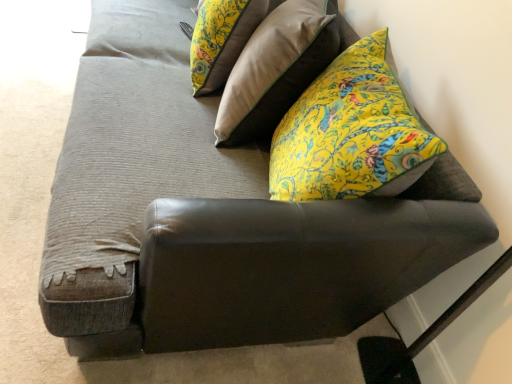
This screenshot has height=384, width=512. What do you see at coordinates (222, 39) in the screenshot?
I see `floral fabric pillow at upper center, arranged as the 1th pillow when viewed from the left` at bounding box center [222, 39].

The image size is (512, 384). In order to click on floral fabric pillow at upper center, arranged as the 1th pillow when viewed from the left in this screenshot , I will do `click(222, 39)`.

Based on the photo, how much space does floral yellow pillow at upper right, arranged as the second pillow when viewed from the left, occupy vertically?

floral yellow pillow at upper right, arranged as the second pillow when viewed from the left, is 26.24 inches tall.

This screenshot has height=384, width=512. What do you see at coordinates (276, 69) in the screenshot?
I see `floral yellow pillow at upper right, arranged as the second pillow when viewed from the left` at bounding box center [276, 69].

How much space does floral yellow pillow at upper right, placed as the first pillow when sorted from right to left, occupy horizontally?

It is 12.90 inches.

The height and width of the screenshot is (384, 512). I want to click on floral yellow pillow at upper right, placed as the first pillow when sorted from right to left, so click(x=276, y=69).

Where is `floral fabric pillow at upper center, which is counted as the 2th pillow, starting from the right`? The width and height of the screenshot is (512, 384). floral fabric pillow at upper center, which is counted as the 2th pillow, starting from the right is located at coordinates (222, 39).

Is floral yellow pillow at upper right, arranged as the second pillow when viewed from the left, to the right of floral fabric pillow at upper center, arranged as the 1th pillow when viewed from the left, from the viewer's perspective?

Indeed, floral yellow pillow at upper right, arranged as the second pillow when viewed from the left, is positioned on the right side of floral fabric pillow at upper center, arranged as the 1th pillow when viewed from the left.

Does floral yellow pillow at upper right, arranged as the second pillow when viewed from the left, lie in front of floral fabric pillow at upper center, arranged as the 1th pillow when viewed from the left?

Yes, the depth of floral yellow pillow at upper right, arranged as the second pillow when viewed from the left, is less than that of floral fabric pillow at upper center, arranged as the 1th pillow when viewed from the left.

Which point is more forward, [302,75] or [257,9]?

Point [302,75]

From the image's perspective, is floral yellow pillow at upper right, arranged as the second pillow when viewed from the left, under floral fabric pillow at upper center, arranged as the 1th pillow when viewed from the left?

Yes.

From a real-world perspective, is floral yellow pillow at upper right, placed as the first pillow when sorted from right to left, physically above floral fabric pillow at upper center, arranged as the 1th pillow when viewed from the left?

Yes.

Which object is thinner, floral yellow pillow at upper right, arranged as the second pillow when viewed from the left, or floral fabric pillow at upper center, which is counted as the 2th pillow, starting from the right?

floral fabric pillow at upper center, which is counted as the 2th pillow, starting from the right.

Considering the sizes of objects floral yellow pillow at upper right, arranged as the second pillow when viewed from the left, and floral fabric pillow at upper center, arranged as the 1th pillow when viewed from the left, in the image provided, who is taller, floral yellow pillow at upper right, arranged as the second pillow when viewed from the left, or floral fabric pillow at upper center, arranged as the 1th pillow when viewed from the left,?

floral yellow pillow at upper right, arranged as the second pillow when viewed from the left.

Can you confirm if floral yellow pillow at upper right, arranged as the second pillow when viewed from the left, is bigger than floral fabric pillow at upper center, which is counted as the 2th pillow, starting from the right?

Yes, floral yellow pillow at upper right, arranged as the second pillow when viewed from the left, is bigger than floral fabric pillow at upper center, which is counted as the 2th pillow, starting from the right.

Choose the correct answer: Is floral yellow pillow at upper right, placed as the first pillow when sorted from right to left, inside floral fabric pillow at upper center, arranged as the 1th pillow when viewed from the left, or outside it?

floral yellow pillow at upper right, placed as the first pillow when sorted from right to left, is outside floral fabric pillow at upper center, arranged as the 1th pillow when viewed from the left.

Based on the photo, are floral yellow pillow at upper right, placed as the first pillow when sorted from right to left, and floral fabric pillow at upper center, which is counted as the 2th pillow, starting from the right, making contact?

floral yellow pillow at upper right, placed as the first pillow when sorted from right to left, and floral fabric pillow at upper center, which is counted as the 2th pillow, starting from the right, are not in contact.

Is floral yellow pillow at upper right, placed as the first pillow when sorted from right to left, positioned with its back to floral fabric pillow at upper center, arranged as the 1th pillow when viewed from the left?

Yes, floral yellow pillow at upper right, placed as the first pillow when sorted from right to left, is positioned with its back facing floral fabric pillow at upper center, arranged as the 1th pillow when viewed from the left.

How far apart are floral yellow pillow at upper right, arranged as the second pillow when viewed from the left, and floral fabric pillow at upper center, which is counted as the 2th pillow, starting from the right?

floral yellow pillow at upper right, arranged as the second pillow when viewed from the left, is 19.14 centimeters from floral fabric pillow at upper center, which is counted as the 2th pillow, starting from the right.

The width and height of the screenshot is (512, 384). Find the location of `pillow below the floral yellow pillow at upper right, placed as the first pillow when sorted from right to left (from a real-world perspective)`. pillow below the floral yellow pillow at upper right, placed as the first pillow when sorted from right to left (from a real-world perspective) is located at coordinates (222, 39).

In the image, is floral fabric pillow at upper center, arranged as the 1th pillow when viewed from the left, on the left side or the right side of floral yellow pillow at upper right, placed as the first pillow when sorted from right to left?

Based on their positions, floral fabric pillow at upper center, arranged as the 1th pillow when viewed from the left, is located to the left of floral yellow pillow at upper right, placed as the first pillow when sorted from right to left.

Is the depth of floral fabric pillow at upper center, arranged as the 1th pillow when viewed from the left, less than that of floral yellow pillow at upper right, placed as the first pillow when sorted from right to left?

No.

Does point (207, 35) come behind point (239, 76)?

Yes.

From the image's perspective, who appears lower, floral fabric pillow at upper center, which is counted as the 2th pillow, starting from the right, or floral yellow pillow at upper right, arranged as the second pillow when viewed from the left?

floral yellow pillow at upper right, arranged as the second pillow when viewed from the left.

From a real-world perspective, which object rests below the other?

floral fabric pillow at upper center, arranged as the 1th pillow when viewed from the left.

Considering the sizes of objects floral fabric pillow at upper center, arranged as the 1th pillow when viewed from the left, and floral yellow pillow at upper right, arranged as the second pillow when viewed from the left, in the image provided, who is wider, floral fabric pillow at upper center, arranged as the 1th pillow when viewed from the left, or floral yellow pillow at upper right, arranged as the second pillow when viewed from the left,?

floral yellow pillow at upper right, arranged as the second pillow when viewed from the left, is wider.

Considering the relative sizes of floral fabric pillow at upper center, arranged as the 1th pillow when viewed from the left, and floral yellow pillow at upper right, placed as the first pillow when sorted from right to left, in the image provided, is floral fabric pillow at upper center, arranged as the 1th pillow when viewed from the left, taller than floral yellow pillow at upper right, placed as the first pillow when sorted from right to left,?

No, floral fabric pillow at upper center, arranged as the 1th pillow when viewed from the left, is not taller than floral yellow pillow at upper right, placed as the first pillow when sorted from right to left.

Can you confirm if floral fabric pillow at upper center, arranged as the 1th pillow when viewed from the left, is bigger than floral yellow pillow at upper right, placed as the first pillow when sorted from right to left?

Actually, floral fabric pillow at upper center, arranged as the 1th pillow when viewed from the left, might be smaller than floral yellow pillow at upper right, placed as the first pillow when sorted from right to left.

Does floral fabric pillow at upper center, which is counted as the 2th pillow, starting from the right, contain floral yellow pillow at upper right, placed as the first pillow when sorted from right to left?

No, floral yellow pillow at upper right, placed as the first pillow when sorted from right to left, is not a part of floral fabric pillow at upper center, which is counted as the 2th pillow, starting from the right.

Are floral fabric pillow at upper center, which is counted as the 2th pillow, starting from the right, and floral yellow pillow at upper right, arranged as the second pillow when viewed from the left, making contact?

No, floral fabric pillow at upper center, which is counted as the 2th pillow, starting from the right, is not in contact with floral yellow pillow at upper right, arranged as the second pillow when viewed from the left.

In the scene shown: Is floral fabric pillow at upper center, arranged as the 1th pillow when viewed from the left, oriented away from floral yellow pillow at upper right, arranged as the second pillow when viewed from the left?

Absolutely, floral fabric pillow at upper center, arranged as the 1th pillow when viewed from the left, is directed away from floral yellow pillow at upper right, arranged as the second pillow when viewed from the left.

Where is `pillow lying behind the floral yellow pillow at upper right, placed as the first pillow when sorted from right to left`? The height and width of the screenshot is (384, 512). pillow lying behind the floral yellow pillow at upper right, placed as the first pillow when sorted from right to left is located at coordinates (222, 39).

Where is `pillow on the left of floral yellow pillow at upper right, placed as the first pillow when sorted from right to left`? pillow on the left of floral yellow pillow at upper right, placed as the first pillow when sorted from right to left is located at coordinates (222, 39).

Where is `pillow in front of the floral fabric pillow at upper center, arranged as the 1th pillow when viewed from the left`? The image size is (512, 384). pillow in front of the floral fabric pillow at upper center, arranged as the 1th pillow when viewed from the left is located at coordinates (276, 69).